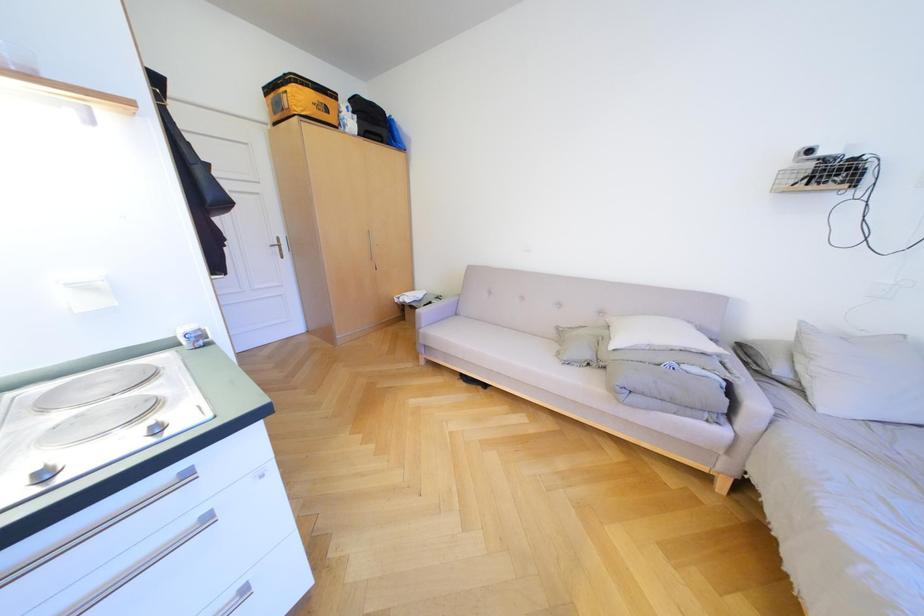
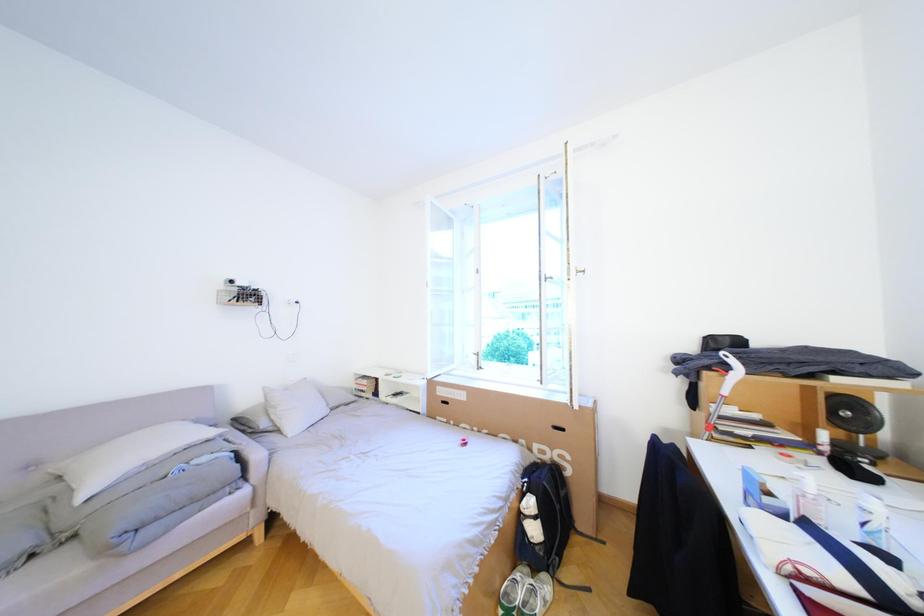
Question: The images are taken continuously from a first-person perspective. In which direction is your viewpoint rotating?

Choices:
 (A) Left
 (B) Right
 (C) Up
 (D) Down

Answer: (B)